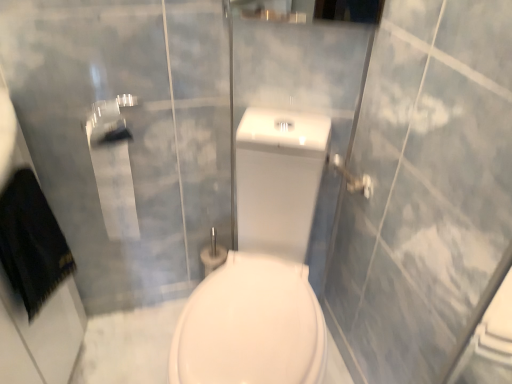
What do you see at coordinates (262, 265) in the screenshot? This screenshot has width=512, height=384. I see `white glossy porcelain at center` at bounding box center [262, 265].

You are a GUI agent. You are given a task and a screenshot of the screen. Output one action in this format:
    pyautogui.click(x=<x>, y=<y>)
    Task: Click on the white glossy porcelain at center
    Image resolution: width=512 pixels, height=384 pixels.
    Given the screenshot: What is the action you would take?
    pyautogui.click(x=262, y=265)

The width and height of the screenshot is (512, 384). Describe the element at coordinates (352, 178) in the screenshot. I see `metallic silver towel bar at upper right` at that location.

At what (x,y) coordinates should I click in order to perform the action: click on metallic silver towel bar at upper right. Please return your answer as a coordinate pair (x, y). Looking at the image, I should click on (352, 178).

Where is `white glossy porcelain at center`? The width and height of the screenshot is (512, 384). white glossy porcelain at center is located at coordinates (262, 265).

Considering the positions of objects metallic silver towel bar at upper right and white glossy porcelain at center in the image provided, who is more to the left, metallic silver towel bar at upper right or white glossy porcelain at center?

white glossy porcelain at center.

Considering the positions of objects metallic silver towel bar at upper right and white glossy porcelain at center in the image provided, who is in front, metallic silver towel bar at upper right or white glossy porcelain at center?

white glossy porcelain at center is closer to the camera.

Which is farther, (x=346, y=181) or (x=238, y=176)?

The point (x=346, y=181) is farther.

From the image's perspective, is metallic silver towel bar at upper right below white glossy porcelain at center?

No.

From a real-world perspective, is metallic silver towel bar at upper right above or below white glossy porcelain at center?

metallic silver towel bar at upper right is above white glossy porcelain at center.

Considering the relative sizes of metallic silver towel bar at upper right and white glossy porcelain at center in the image provided, is metallic silver towel bar at upper right wider than white glossy porcelain at center?

No, metallic silver towel bar at upper right is not wider than white glossy porcelain at center.

Does metallic silver towel bar at upper right have a lesser height compared to white glossy porcelain at center?

Yes, metallic silver towel bar at upper right is shorter than white glossy porcelain at center.

Which of these two, metallic silver towel bar at upper right or white glossy porcelain at center, is bigger?

white glossy porcelain at center is bigger.

Is metallic silver towel bar at upper right not inside white glossy porcelain at center?

That's incorrect, metallic silver towel bar at upper right is not completely outside white glossy porcelain at center.

Is metallic silver towel bar at upper right not near white glossy porcelain at center?

No.

Does metallic silver towel bar at upper right turn towards white glossy porcelain at center?

Yes.

What are the coordinates of `porcelain that is on the left side of metallic silver towel bar at upper right` in the screenshot? It's located at (262, 265).

In the scene shown: Visually, is white glossy porcelain at center positioned to the left or to the right of metallic silver towel bar at upper right?

In the image, white glossy porcelain at center appears on the left side of metallic silver towel bar at upper right.

Which is in front, white glossy porcelain at center or metallic silver towel bar at upper right?

Positioned in front is white glossy porcelain at center.

Does point (209, 323) come in front of point (335, 158)?

That is True.

From the image's perspective, which one is positioned lower, white glossy porcelain at center or metallic silver towel bar at upper right?

white glossy porcelain at center is shown below in the image.

From a real-world perspective, is white glossy porcelain at center above or below metallic silver towel bar at upper right?

white glossy porcelain at center is below metallic silver towel bar at upper right.

Which of these two, white glossy porcelain at center or metallic silver towel bar at upper right, is wider?

With larger width is white glossy porcelain at center.

Does white glossy porcelain at center have a greater height compared to metallic silver towel bar at upper right?

Yes.

Between white glossy porcelain at center and metallic silver towel bar at upper right, which one has larger size?

white glossy porcelain at center.

Consider the image. Can metallic silver towel bar at upper right be found inside white glossy porcelain at center?

Yes.

Is white glossy porcelain at center next to metallic silver towel bar at upper right?

No, white glossy porcelain at center is not making contact with metallic silver towel bar at upper right.

Is white glossy porcelain at center facing away from metallic silver towel bar at upper right?

white glossy porcelain at center is not turned away from metallic silver towel bar at upper right.

At what (x,y) coordinates should I click in order to perform the action: click on towel bar above the white glossy porcelain at center (from the image's perspective). Please return your answer as a coordinate pair (x, y). This screenshot has width=512, height=384. Looking at the image, I should click on (352, 178).

The height and width of the screenshot is (384, 512). Find the location of `towel bar above the white glossy porcelain at center (from the image's perspective)`. towel bar above the white glossy porcelain at center (from the image's perspective) is located at coordinates (352, 178).

You are a GUI agent. You are given a task and a screenshot of the screen. Output one action in this format:
    pyautogui.click(x=<x>, y=<y>)
    Task: Click on the porcelain lying below the metallic silver towel bar at upper right (from the image's perspective)
    
    Given the screenshot: What is the action you would take?
    pyautogui.click(x=262, y=265)